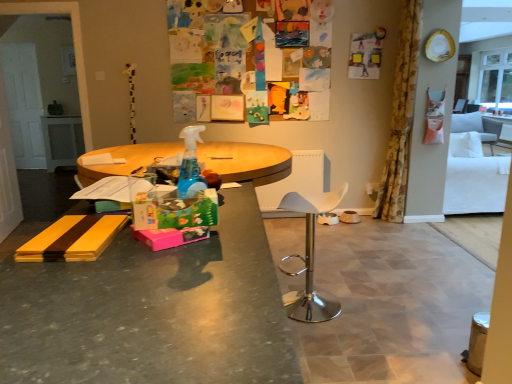
At what (x,y) coordinates should I click in order to perform the action: click on vacant area on the back side of white plastic chair at center. Please return your answer as a coordinate pair (x, y). The height and width of the screenshot is (384, 512). Looking at the image, I should click on point(318,282).